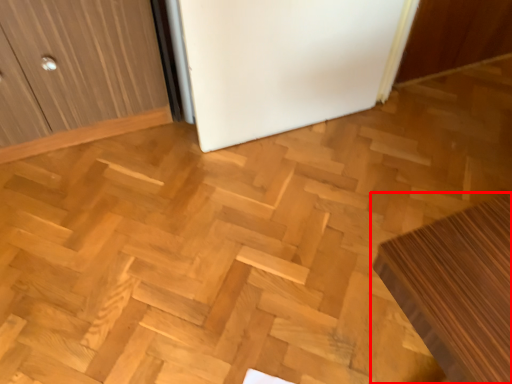
Question: From the image's perspective, where is furniture (annotated by the red box) located in relation to fridge in the image?

Choices:
 (A) above
 (B) below

Answer: (B)